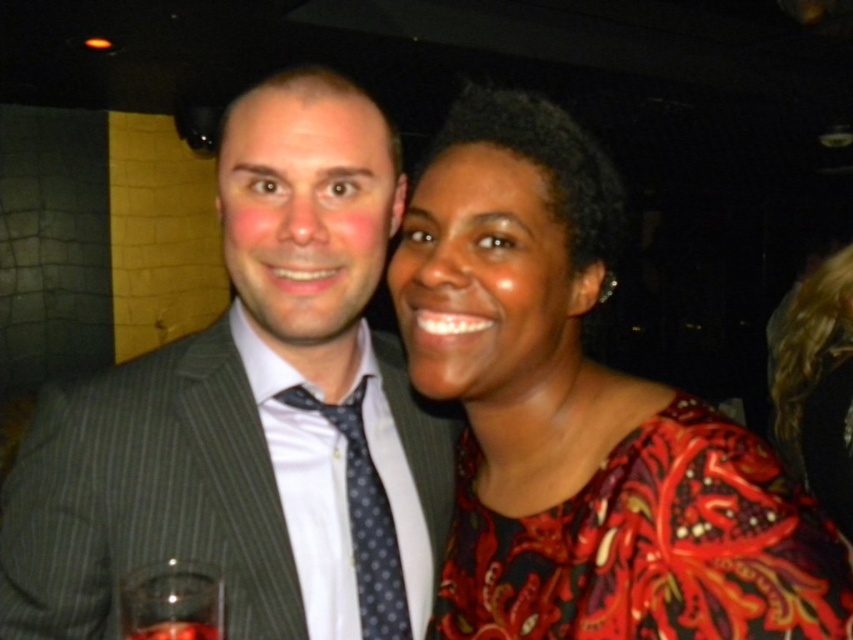
How distant is transparent glass at lower left from translucent glass at lower left?

transparent glass at lower left is 1.18 inches away from translucent glass at lower left.

Does point (204, 600) come behind point (161, 637)?

Yes, point (204, 600) is behind point (161, 637).

Where is `transparent glass at lower left`? transparent glass at lower left is located at coordinates (172, 602).

Can you confirm if floral-patterned fabric dress at center is positioned above translucent glass at lower left?

Correct, floral-patterned fabric dress at center is located above translucent glass at lower left.

Is point (699, 410) positioned after point (152, 632)?

That is True.

Based on the photo, who is more forward, (778,582) or (202,632)?

Point (202,632)

The height and width of the screenshot is (640, 853). In order to click on floral-patterned fabric dress at center in this screenshot , I will do `click(651, 547)`.

What do you see at coordinates (582, 419) in the screenshot?
I see `floral-patterned blouse at center` at bounding box center [582, 419].

Is floral-patterned blouse at center below polka dot silk tie at center?

Actually, floral-patterned blouse at center is above polka dot silk tie at center.

Is point (520, 339) behind point (380, 548)?

No, (520, 339) is in front of (380, 548).

Identify the location of floral-patterned blouse at center. (582, 419).